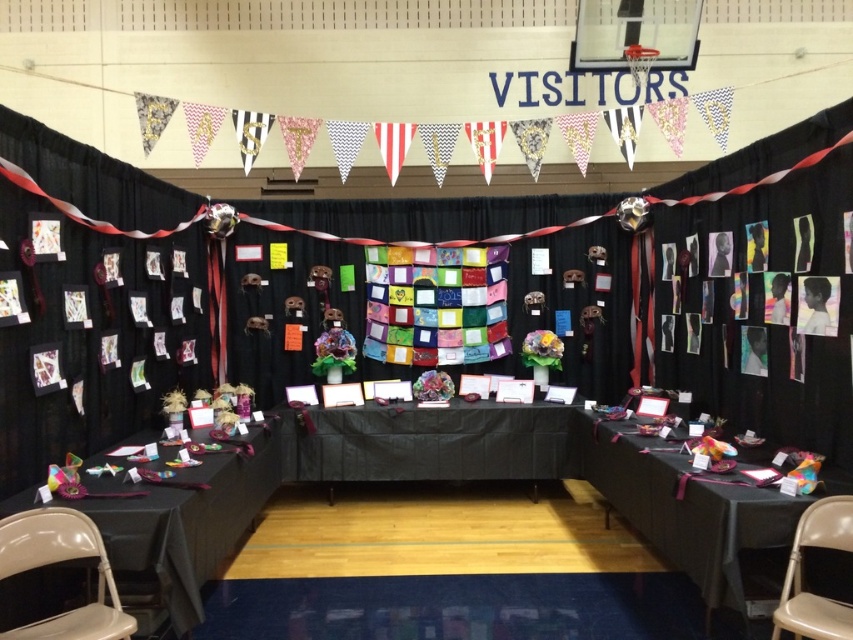
You are a guest at the exhibition and want to sit down to view the artwork displayed on the black fabric table at center. There is a beige fabric chair at lower right available. Can you comfortably walk from the chair to the table without any obstacles?

The distance between the black fabric table at center and the beige fabric chair at lower right is 2.62 meters, which is a reasonable distance for walking comfortably. Assuming there are no obstacles in between, you can walk from the chair to the table without any issues.